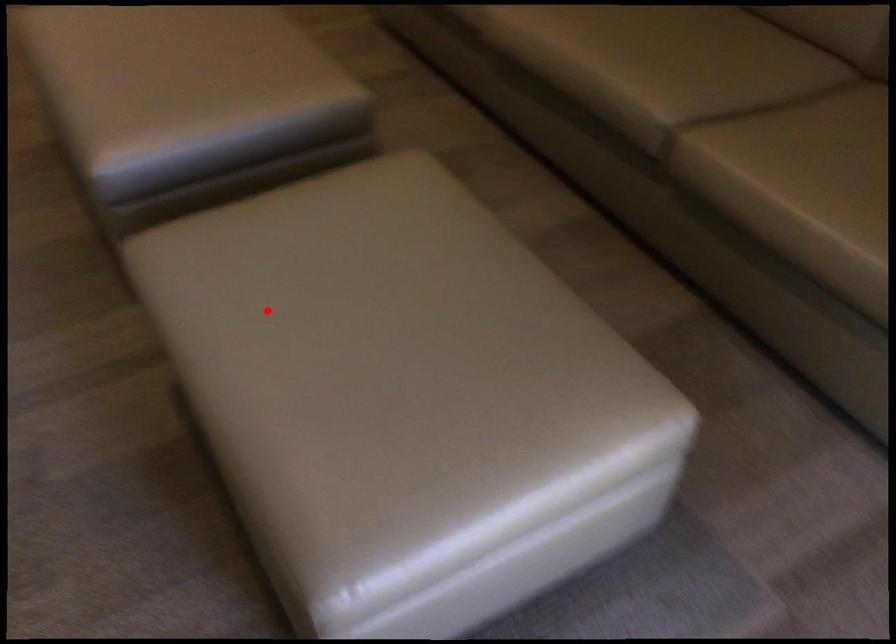
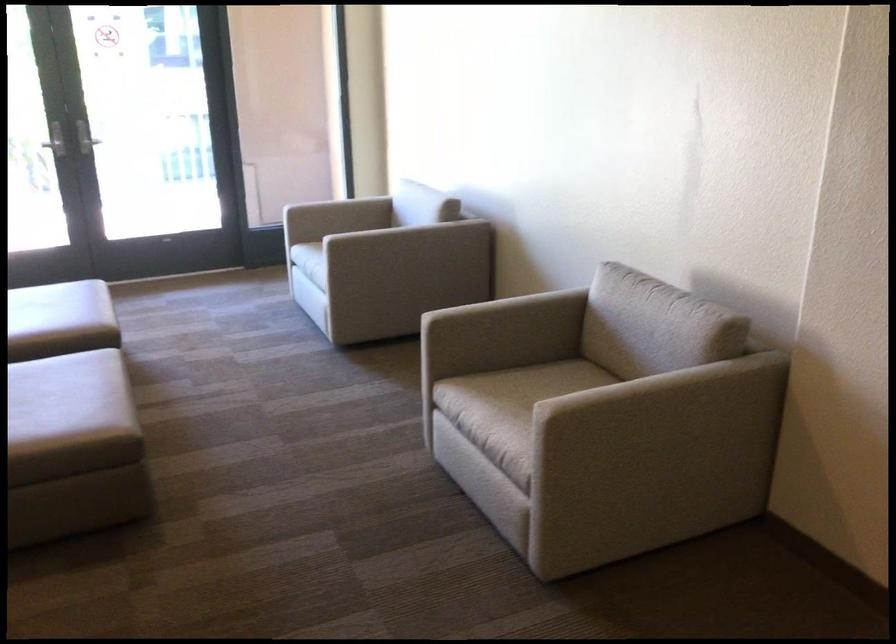
Question: I am providing you with two images of the same scene from different viewpoints. Given a red point in image1, look at the same physical point in image2. Is it:

Choices:
 (A) Closer to the viewpoint
 (B) Farther from the viewpoint

Answer: (B)